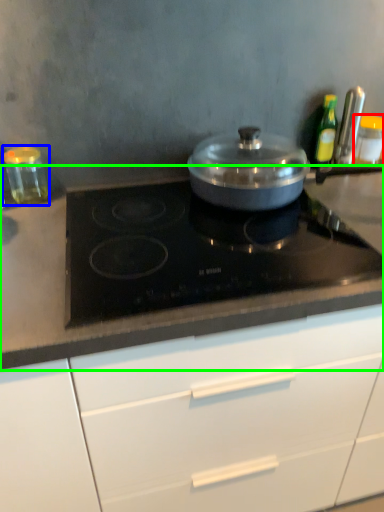
Question: Which is nearer to the kitchen appliance (highlighted by a red box)? kitchen appliance (highlighted by a blue box) or countertop (highlighted by a green box).

Choices:
 (A) kitchen appliance
 (B) countertop

Answer: (B)